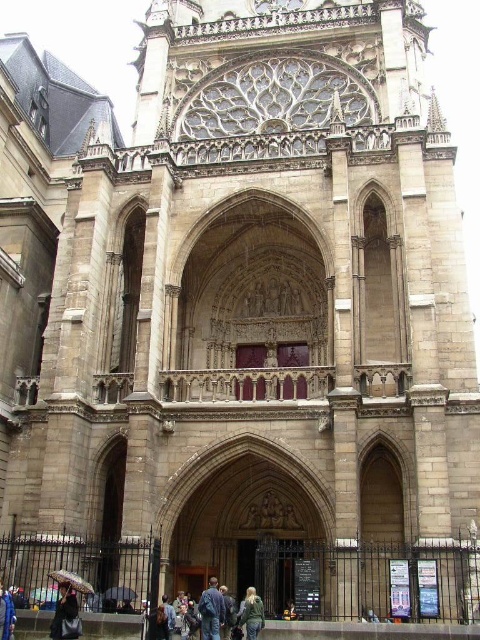
Question: Which is farther from the blue down jacket at lower left?

Choices:
 (A) rainbow-patterned fabric umbrella at lower left
 (B) dark brown leather jacket at lower left

Answer: (A)

Question: Does rainbow-patterned fabric umbrella at lower left have a smaller size compared to black matte umbrella at lower left?

Choices:
 (A) yes
 (B) no

Answer: (B)

Question: Is blue down jacket at lower left bigger than black matte umbrella at lower center?

Choices:
 (A) no
 (B) yes

Answer: (B)

Question: Which is nearer to the black matte umbrella at lower left?

Choices:
 (A) dark brown leather jacket at lower left
 (B) denim jacket at lower center
 (C) green denim jacket at lower center
 (D) blue down jacket at lower left

Answer: (D)

Question: Among these points, which one is farthest from the camera?

Choices:
 (A) (118, 595)
 (B) (68, 627)
 (C) (207, 627)

Answer: (A)

Question: Can you confirm if dark brown leather jacket at lower left is wider than brown fabric umbrella at lower left?

Choices:
 (A) yes
 (B) no

Answer: (A)